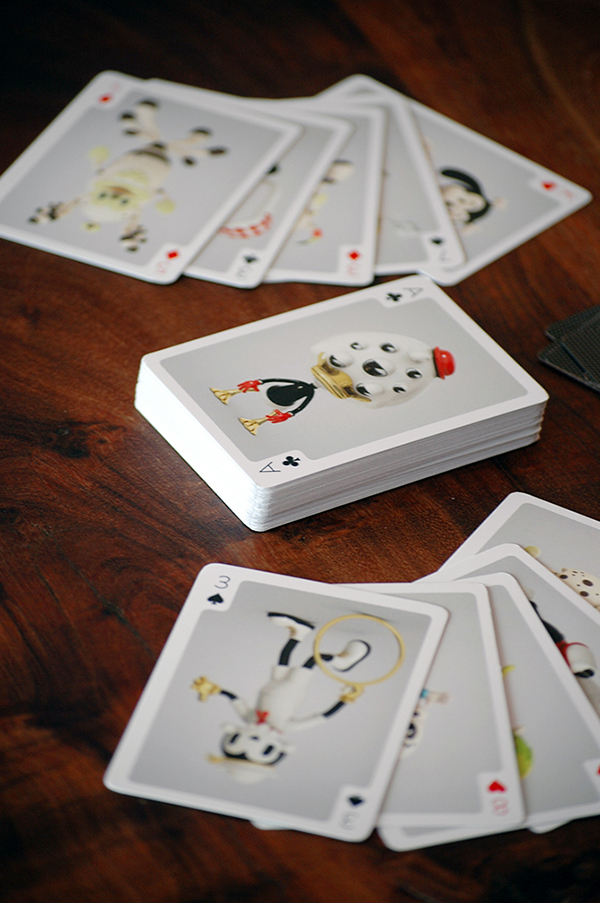
Identify the location of table. (75, 825).